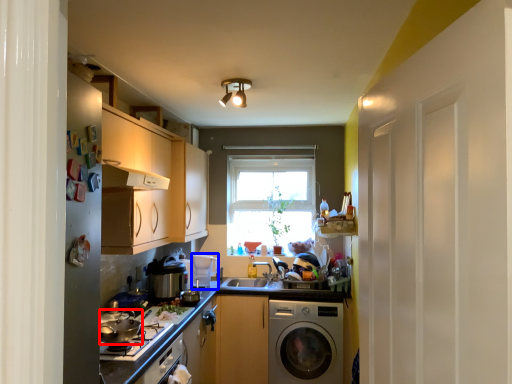
Question: Which point is closer to the camera, appliance (highlighted by a red box) or appliance (highlighted by a blue box)?

Choices:
 (A) appliance
 (B) appliance

Answer: (A)